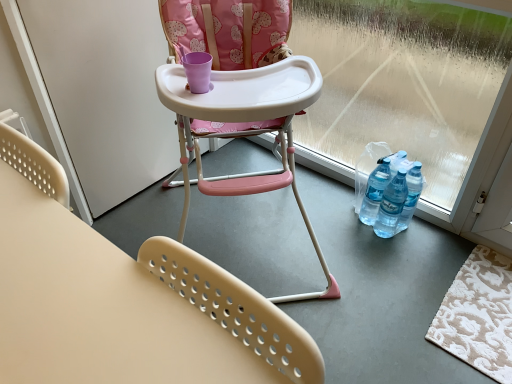
You are a GUI agent. You are given a task and a screenshot of the screen. Output one action in this format:
    pyautogui.click(x=<x>, y=<y>)
    Task: Click on the vacant space that is in between pink plastic highchair at center, the 2th chair when ordered from front to back, and beige textured rug at lower right
    The image size is (512, 384).
    Given the screenshot: What is the action you would take?
    pyautogui.click(x=378, y=275)